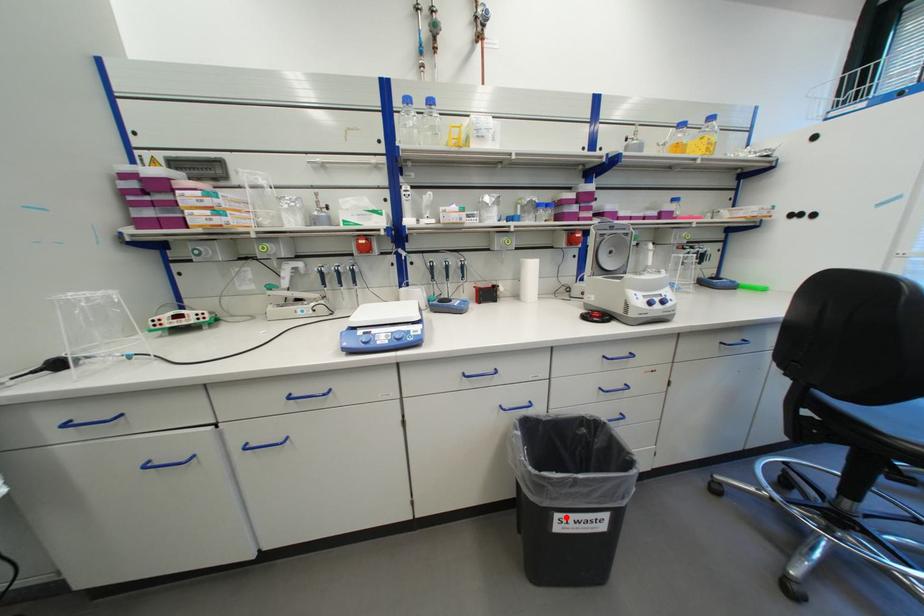
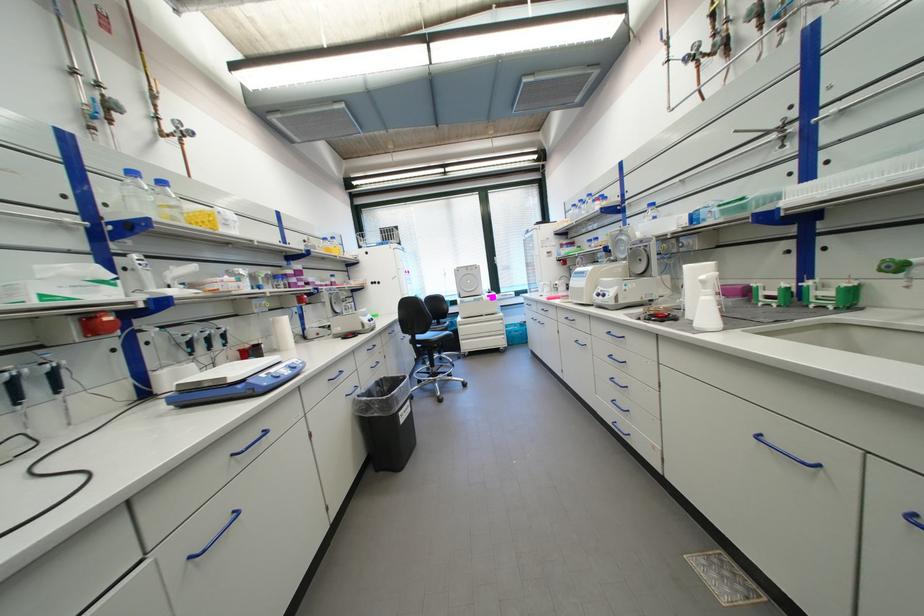
In the second image, find the point that corresponds to the highlighted location in the first image.

(407, 415)